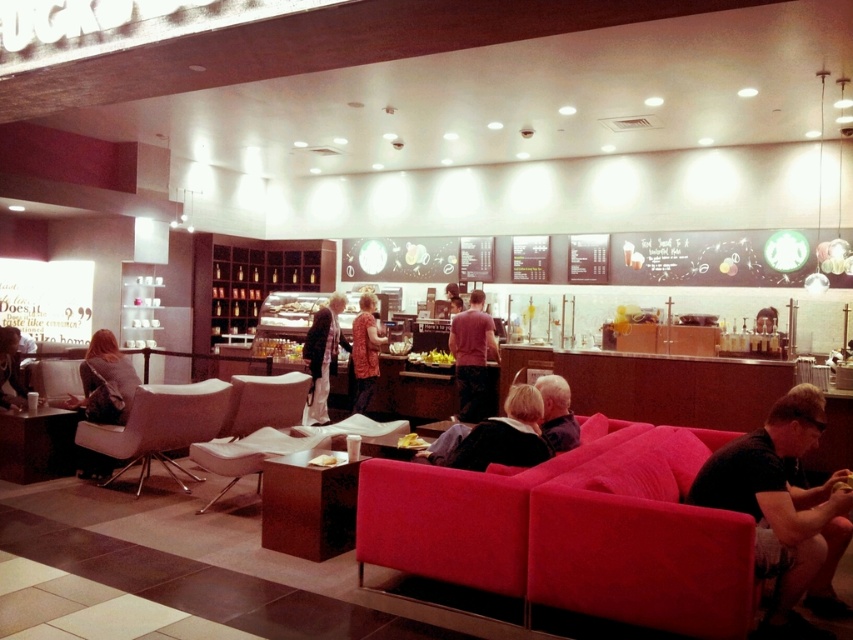
Question: Is velvet red couch at lower right behind white leather chair at center?

Choices:
 (A) no
 (B) yes

Answer: (A)

Question: Which point appears closest to the camera in this image?

Choices:
 (A) (653, 476)
 (B) (253, 428)
 (C) (529, 456)

Answer: (A)

Question: Which point is farther from the camera taking this photo?

Choices:
 (A) (402, 448)
 (B) (368, 339)
 (C) (9, 404)

Answer: (B)

Question: Does striped fabric shirt at center have a lesser width compared to matte black jacket at lower left?

Choices:
 (A) no
 (B) yes

Answer: (B)

Question: In this image, where is striped fabric shirt at center located relative to yellow matte sandwich at center?

Choices:
 (A) right
 (B) left

Answer: (B)

Question: Which of these objects is positioned farthest from the golden crispy pastry at center?

Choices:
 (A) striped fabric shirt at center
 (B) patterned fabric shirt at center

Answer: (A)